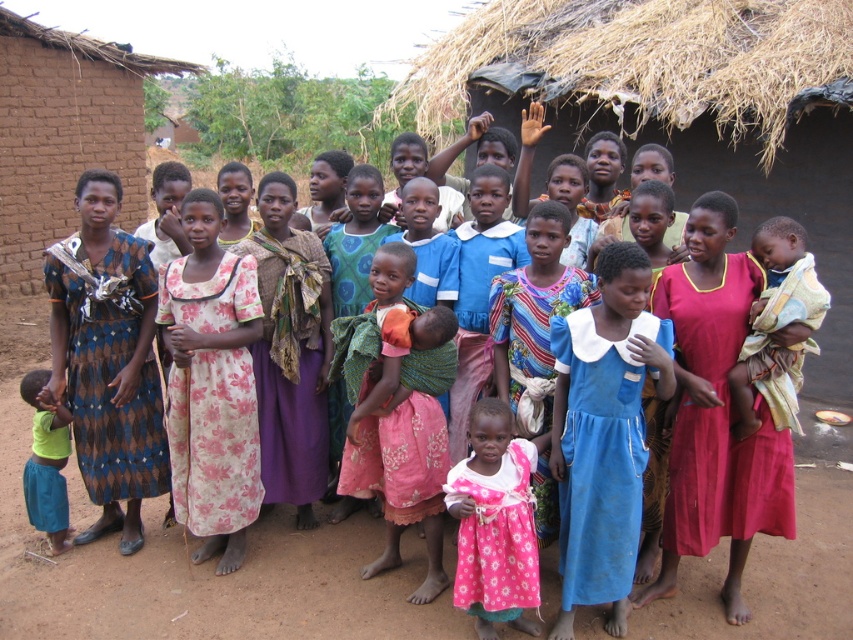
Is purple textured dress at center above green fabric shirt at lower left?

Correct, purple textured dress at center is located above green fabric shirt at lower left.

Describe the element at coordinates (289, 353) in the screenshot. I see `purple textured dress at center` at that location.

Locate an element on the screen. This screenshot has height=640, width=853. purple textured dress at center is located at coordinates (289, 353).

Who is positioned more to the left, floral cotton dress at center or green fabric shirt at lower left?

Positioned to the left is green fabric shirt at lower left.

Does floral cotton dress at center appear under green fabric shirt at lower left?

No, floral cotton dress at center is not below green fabric shirt at lower left.

Does point (161, 304) come closer to viewer compared to point (48, 456)?

Yes, it is in front of point (48, 456).

The image size is (853, 640). Find the location of `floral cotton dress at center`. floral cotton dress at center is located at coordinates (213, 442).

Who is positioned more to the left, floral cotton dress at center or purple textured dress at center?

floral cotton dress at center is more to the left.

Who is more distant from viewer, [247,449] or [312,330]?

Point [312,330]

Which is behind, point (230, 417) or point (260, 216)?

Positioned behind is point (260, 216).

Where is `floral cotton dress at center`? floral cotton dress at center is located at coordinates (x=213, y=442).